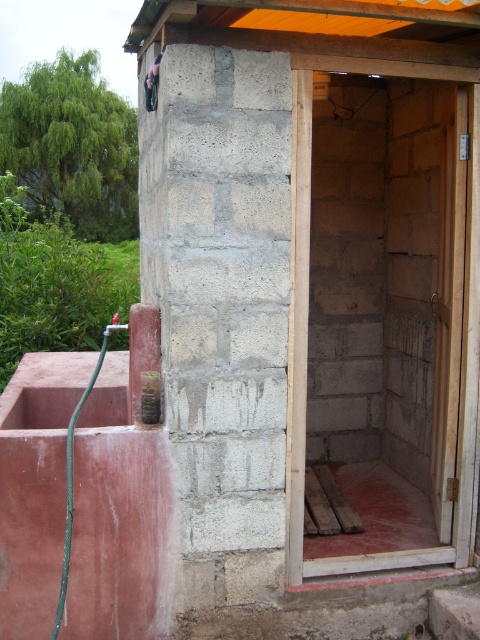
Question: Does gray concrete block at center have a lesser width compared to green rubber hose at lower left?

Choices:
 (A) no
 (B) yes

Answer: (A)

Question: From the image, what is the correct spatial relationship of gray concrete block at center in relation to green rubber hose at lower left?

Choices:
 (A) right
 (B) left

Answer: (A)

Question: Which point is closer to the camera?

Choices:
 (A) gray concrete block at center
 (B) green rubber hose at lower left

Answer: (A)

Question: Is gray concrete block at center above green rubber hose at lower left?

Choices:
 (A) no
 (B) yes

Answer: (B)

Question: Which point is farther from the camera taking this photo?

Choices:
 (A) (71, 540)
 (B) (162, 193)

Answer: (B)